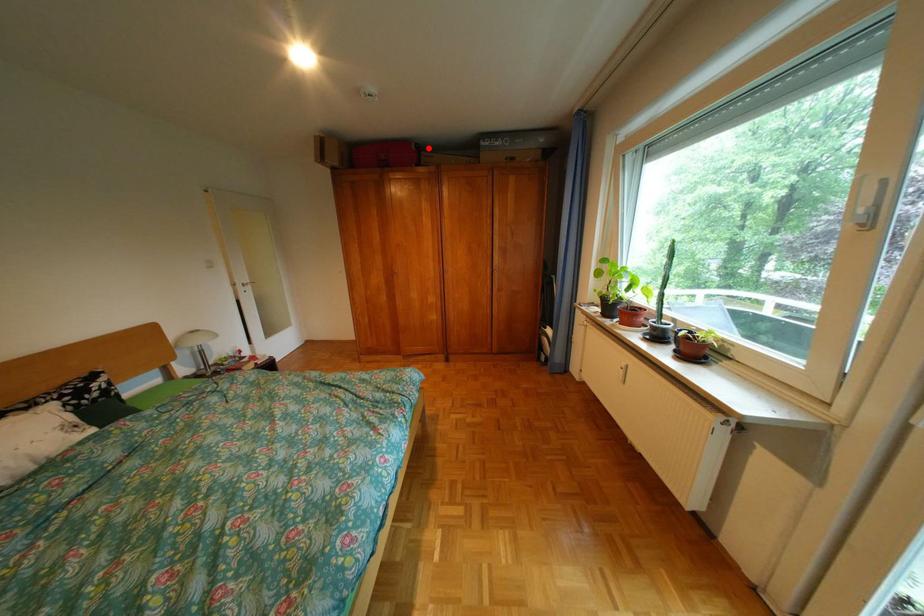
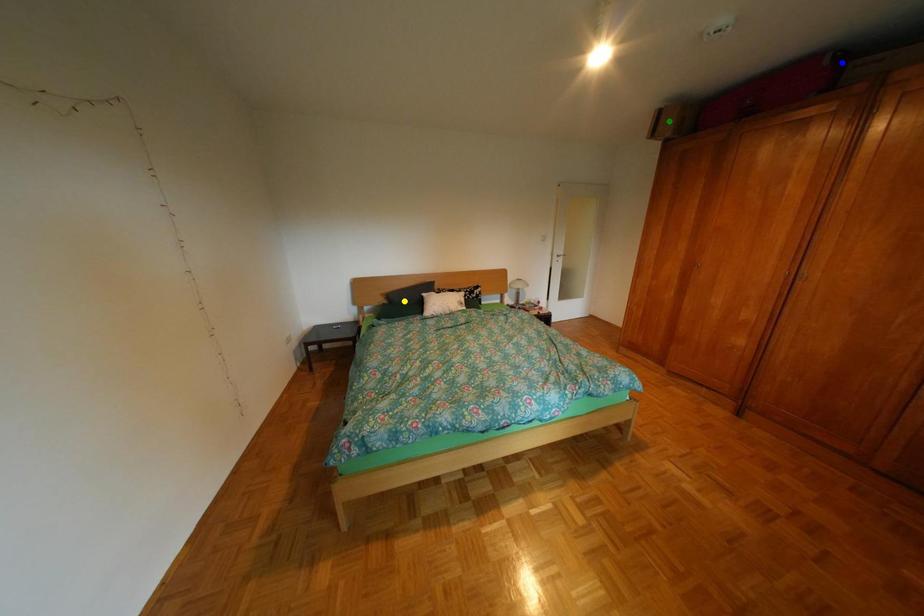
Question: I am providing you with two images of the same scene from different viewpoints. A red point is marked on the first image. You are given multiple points on the second image. Which point in image 2 represents the same 3d spot as the red point in image 1?

Choices:
 (A) yellow point
 (B) green point
 (C) blue point

Answer: (C)